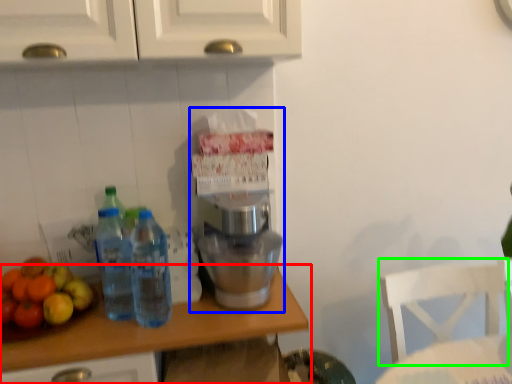
Question: Considering the real-world distances, which object is farthest from countertop (highlighted by a red box)? home appliance (highlighted by a blue box) or chair (highlighted by a green box)?

Choices:
 (A) home appliance
 (B) chair

Answer: (B)